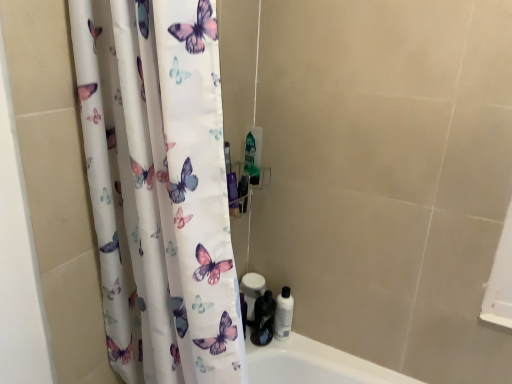
What is the approximate width of shiny black bottle at lower right, the first toiletry viewed from the left?

9.84 centimeters.

Locate an element on the screen. white glossy bottle at lower right, which ranks as the 2th toiletry in left-to-right order is located at coordinates (283, 314).

Who is shorter, shiny black bottle at lower right, positioned as the 2th toiletry in right-to-left order, or white matte toilet paper at lower center?

shiny black bottle at lower right, positioned as the 2th toiletry in right-to-left order, is shorter.

Are shiny black bottle at lower right, positioned as the 2th toiletry in right-to-left order, and white matte toilet paper at lower center beside each other?

Absolutely, shiny black bottle at lower right, positioned as the 2th toiletry in right-to-left order, is next to and touching white matte toilet paper at lower center.

Is the position of shiny black bottle at lower right, the first toiletry viewed from the left, less distant than that of white matte toilet paper at lower center?

Yes, it is in front of white matte toilet paper at lower center.

From the image's perspective, starting from the white matte toilet paper at lower center, which toiletry is the 2nd one below? Please provide its 2D coordinates.

[(263, 319)]

Which point is more distant from viewer, (258, 313) or (278, 300)?

The point (258, 313) is more distant.

Is there a large distance between shiny black bottle at lower right, the first toiletry viewed from the left, and white glossy bottle at lower right, which ranks as the 2th toiletry in left-to-right order?

No, there isn't a large distance between shiny black bottle at lower right, the first toiletry viewed from the left, and white glossy bottle at lower right, which ranks as the 2th toiletry in left-to-right order.

Which point is more forward, (x=245, y=276) or (x=264, y=332)?

Positioned in front is point (x=264, y=332).

Does white matte toilet paper at lower center appear on the right side of shiny black bottle at lower right, the first toiletry viewed from the left?

In fact, white matte toilet paper at lower center is to the left of shiny black bottle at lower right, the first toiletry viewed from the left.

From a real-world perspective, is white matte toilet paper at lower center physically below shiny black bottle at lower right, the first toiletry viewed from the left?

Actually, white matte toilet paper at lower center is physically above shiny black bottle at lower right, the first toiletry viewed from the left, in the real world.

Which of these two, white matte toilet paper at lower center or shiny black bottle at lower right, positioned as the 2th toiletry in right-to-left order, stands shorter?

With less height is shiny black bottle at lower right, positioned as the 2th toiletry in right-to-left order.

Is white glossy bottle at lower right, which ranks as the 2th toiletry in left-to-right order, to the left of white matte toilet paper at lower center from the viewer's perspective?

In fact, white glossy bottle at lower right, which ranks as the 2th toiletry in left-to-right order, is to the right of white matte toilet paper at lower center.

Considering the relative sizes of white glossy bottle at lower right, which ranks as the 2th toiletry in left-to-right order, and white matte toilet paper at lower center in the image provided, is white glossy bottle at lower right, which ranks as the 2th toiletry in left-to-right order, bigger than white matte toilet paper at lower center?

Incorrect, white glossy bottle at lower right, which ranks as the 2th toiletry in left-to-right order, is not larger than white matte toilet paper at lower center.

How different are the orientations of white glossy bottle at lower right, which is the 1th toiletry from right to left, and white matte toilet paper at lower center in degrees?

They differ by 3.89 degrees in their facing directions.

Between white glossy bottle at lower right, which is the 1th toiletry from right to left, and white matte toilet paper at lower center, which one has larger width?

Wider between the two is white matte toilet paper at lower center.

Which of these two, white glossy bottle at lower right, which is the 1th toiletry from right to left, or shiny black bottle at lower right, the first toiletry viewed from the left, is bigger?

shiny black bottle at lower right, the first toiletry viewed from the left, is bigger.

Is white glossy bottle at lower right, which ranks as the 2th toiletry in left-to-right order, not close to shiny black bottle at lower right, positioned as the 2th toiletry in right-to-left order?

That's not correct — white glossy bottle at lower right, which ranks as the 2th toiletry in left-to-right order, is a little close to shiny black bottle at lower right, positioned as the 2th toiletry in right-to-left order.

Which object is more forward, white glossy bottle at lower right, which ranks as the 2th toiletry in left-to-right order, or shiny black bottle at lower right, the first toiletry viewed from the left?

Positioned in front is shiny black bottle at lower right, the first toiletry viewed from the left.

From a real-world perspective, who is located higher, white matte toilet paper at lower center or white glossy bottle at lower right, which ranks as the 2th toiletry in left-to-right order?

In real-world perspective, white matte toilet paper at lower center is above.

Considering the points (252, 316) and (291, 321), which point is behind, point (252, 316) or point (291, 321)?

The point (291, 321) is farther from the camera.

Could you tell me if white matte toilet paper at lower center is turned towards white glossy bottle at lower right, which ranks as the 2th toiletry in left-to-right order?

No, white matte toilet paper at lower center is not oriented towards white glossy bottle at lower right, which ranks as the 2th toiletry in left-to-right order.

Does white matte toilet paper at lower center have a lesser height compared to white glossy bottle at lower right, which ranks as the 2th toiletry in left-to-right order?

In fact, white matte toilet paper at lower center may be taller than white glossy bottle at lower right, which ranks as the 2th toiletry in left-to-right order.

Where is `toilet paper that is behind the shiny black bottle at lower right, positioned as the 2th toiletry in right-to-left order`? This screenshot has height=384, width=512. toilet paper that is behind the shiny black bottle at lower right, positioned as the 2th toiletry in right-to-left order is located at coordinates (252, 291).

You are a GUI agent. You are given a task and a screenshot of the screen. Output one action in this format:
    pyautogui.click(x=<x>, y=<y>)
    Task: Click on the toiletry that is below the white glossy bottle at lower right, which ranks as the 2th toiletry in left-to-right order (from the image's perspective)
    The image size is (512, 384).
    Given the screenshot: What is the action you would take?
    pyautogui.click(x=263, y=319)

Which object lies further to the anchor point shiny black bottle at lower right, the first toiletry viewed from the left, white matte toilet paper at lower center or white glossy bottle at lower right, which is the 1th toiletry from right to left?

white matte toilet paper at lower center is positioned further to the anchor shiny black bottle at lower right, the first toiletry viewed from the left.

Considering their positions, is white matte toilet paper at lower center positioned closer to white glossy bottle at lower right, which is the 1th toiletry from right to left, than shiny black bottle at lower right, positioned as the 2th toiletry in right-to-left order?

The object closer to white glossy bottle at lower right, which is the 1th toiletry from right to left, is shiny black bottle at lower right, positioned as the 2th toiletry in right-to-left order.

When comparing their distances from white matte toilet paper at lower center, does shiny black bottle at lower right, the first toiletry viewed from the left, or white glossy bottle at lower right, which ranks as the 2th toiletry in left-to-right order, seem closer?

Among the two, shiny black bottle at lower right, the first toiletry viewed from the left, is located nearer to white matte toilet paper at lower center.

Consider the image. Considering their positions, is white glossy bottle at lower right, which is the 1th toiletry from right to left, positioned further to white matte toilet paper at lower center than shiny black bottle at lower right, the first toiletry viewed from the left?

white glossy bottle at lower right, which is the 1th toiletry from right to left.

Estimate the real-world distances between objects in this image. Which object is further from shiny black bottle at lower right, positioned as the 2th toiletry in right-to-left order, white glossy bottle at lower right, which ranks as the 2th toiletry in left-to-right order, or white matte toilet paper at lower center?

Among the two, white matte toilet paper at lower center is located further to shiny black bottle at lower right, positioned as the 2th toiletry in right-to-left order.

Considering their positions, is shiny black bottle at lower right, the first toiletry viewed from the left, positioned further to white glossy bottle at lower right, which is the 1th toiletry from right to left, than white matte toilet paper at lower center?

Based on the image, white matte toilet paper at lower center appears to be further to white glossy bottle at lower right, which is the 1th toiletry from right to left.

Locate an element on the screen. The height and width of the screenshot is (384, 512). toiletry between white matte toilet paper at lower center and white glossy bottle at lower right, which is the 1th toiletry from right to left, from left to right is located at coordinates [263, 319].